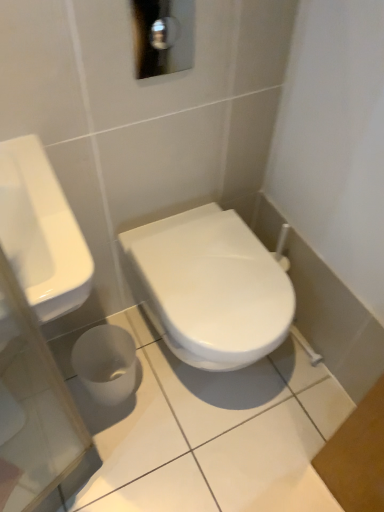
The width and height of the screenshot is (384, 512). What do you see at coordinates (41, 231) in the screenshot?
I see `white glossy sink at left` at bounding box center [41, 231].

What are the coordinates of `white glossy sink at left` in the screenshot? It's located at [x=41, y=231].

Describe the element at coordinates (209, 287) in the screenshot. I see `white glossy toilet at center` at that location.

Image resolution: width=384 pixels, height=512 pixels. What are the coordinates of `white glossy toilet at center` in the screenshot? It's located at coord(209,287).

Image resolution: width=384 pixels, height=512 pixels. I want to click on white glossy sink at left, so click(41, 231).

Based on their positions, is white glossy toilet at center located to the left or right of white glossy sink at left?

From the image, it's evident that white glossy toilet at center is to the right of white glossy sink at left.

Considering the positions of objects white glossy toilet at center and white glossy sink at left in the image provided, who is behind, white glossy toilet at center or white glossy sink at left?

white glossy toilet at center is more distant.

Which is behind, point (146, 293) or point (56, 184)?

The point (146, 293) is more distant.

Consider the image. From the image's perspective, which object appears higher, white glossy toilet at center or white glossy sink at left?

From the image's view, white glossy sink at left is above.

Looking at this image, from a real-world perspective, who is located lower, white glossy toilet at center or white glossy sink at left?

From a 3D spatial view, white glossy toilet at center is below.

In the scene shown: Does white glossy toilet at center have a lesser width compared to white glossy sink at left?

In fact, white glossy toilet at center might be wider than white glossy sink at left.

Considering the relative sizes of white glossy toilet at center and white glossy sink at left in the image provided, is white glossy toilet at center shorter than white glossy sink at left?

In fact, white glossy toilet at center may be taller than white glossy sink at left.

Considering the relative sizes of white glossy toilet at center and white glossy sink at left in the image provided, is white glossy toilet at center smaller than white glossy sink at left?

No, white glossy toilet at center is not smaller than white glossy sink at left.

Would you say white glossy toilet at center contains white glossy sink at left?

No, white glossy toilet at center does not contain white glossy sink at left.

Is white glossy toilet at center next to white glossy sink at left?

No, white glossy toilet at center is not touching white glossy sink at left.

Is white glossy toilet at center facing towards white glossy sink at left?

No.

How many degrees apart are the facing directions of white glossy toilet at center and white glossy sink at left?

0.628 degrees separate the facing orientations of white glossy toilet at center and white glossy sink at left.

How much distance is there between white glossy toilet at center and white glossy sink at left?

white glossy toilet at center and white glossy sink at left are 15.70 inches apart.

At what (x,y) coordinates should I click in order to perform the action: click on sink that appears in front of the white glossy toilet at center. Please return your answer as a coordinate pair (x, y). Looking at the image, I should click on [41, 231].

Is white glossy sink at left at the left side of white glossy toilet at center?

Yes.

Which is behind, white glossy sink at left or white glossy toilet at center?

Positioned behind is white glossy toilet at center.

Which is further, (69, 226) or (242, 231)?

Positioned behind is point (242, 231).

From the image's perspective, would you say white glossy sink at left is shown under white glossy toilet at center?

Actually, white glossy sink at left appears above white glossy toilet at center in the image.

From a real-world perspective, between white glossy sink at left and white glossy toilet at center, who is vertically higher?

white glossy sink at left.

Considering the sizes of white glossy sink at left and white glossy toilet at center in the image, is white glossy sink at left wider or thinner than white glossy toilet at center?

In the image, white glossy sink at left appears to be more narrow than white glossy toilet at center.

In the scene shown: Is white glossy sink at left taller than white glossy toilet at center?

Incorrect, the height of white glossy sink at left is not larger of that of white glossy toilet at center.

Who is smaller, white glossy sink at left or white glossy toilet at center?

white glossy sink at left.

Is white glossy sink at left outside of white glossy toilet at center?

That's correct, white glossy sink at left is outside of white glossy toilet at center.

Is white glossy sink at left next to white glossy toilet at center and touching it?

white glossy sink at left and white glossy toilet at center are clearly separated.

Is white glossy sink at left oriented towards white glossy toilet at center?

No, white glossy sink at left is not oriented towards white glossy toilet at center.

How many degrees apart are the facing directions of white glossy sink at left and white glossy toilet at center?

white glossy sink at left and white glossy toilet at center are facing 0.628 degrees away from each other.

There is a white glossy toilet at center. At what (x,y) coordinates should I click in order to perform the action: click on sink above it (from a real-world perspective). Please return your answer as a coordinate pair (x, y). This screenshot has height=512, width=384. Looking at the image, I should click on (41, 231).

I want to click on sink above the white glossy toilet at center (from the image's perspective), so click(41, 231).

Locate an element on the screen. The width and height of the screenshot is (384, 512). toilet that appears below the white glossy sink at left (from the image's perspective) is located at coordinates (209, 287).